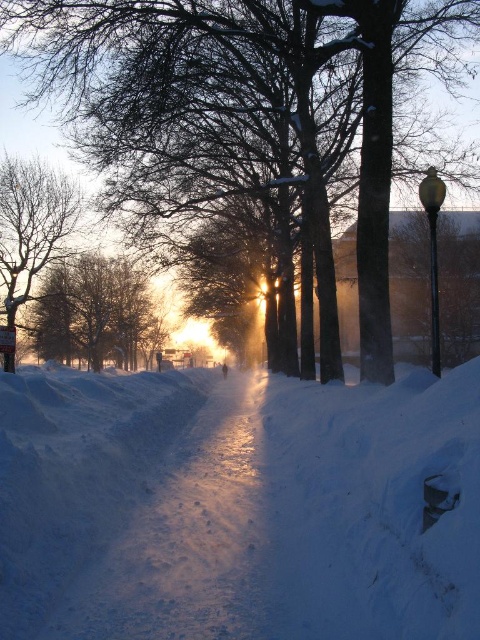
Question: Is white powdery snow at center positioned behind snowy bare tree at left?

Choices:
 (A) no
 (B) yes

Answer: (A)

Question: Estimate the real-world distances between objects in this image. Which object is closer to the snowy branches at center?

Choices:
 (A) white powdery snow at center
 (B) snow-covered tree at center
 (C) snowy bare tree at left

Answer: (C)

Question: Does white powdery snow at center have a greater width compared to snowy branches at center?

Choices:
 (A) no
 (B) yes

Answer: (A)

Question: Which of the following is the closest to the observer?

Choices:
 (A) (105, 262)
 (B) (243, 168)

Answer: (B)

Question: Can you confirm if snow-covered tree at center is smaller than snowy branches at center?

Choices:
 (A) no
 (B) yes

Answer: (A)

Question: Considering the real-world distances, which object is closest to the white powdery snow at center?

Choices:
 (A) snow-covered tree at center
 (B) snowy branches at center
 (C) snowy bare tree at left

Answer: (A)